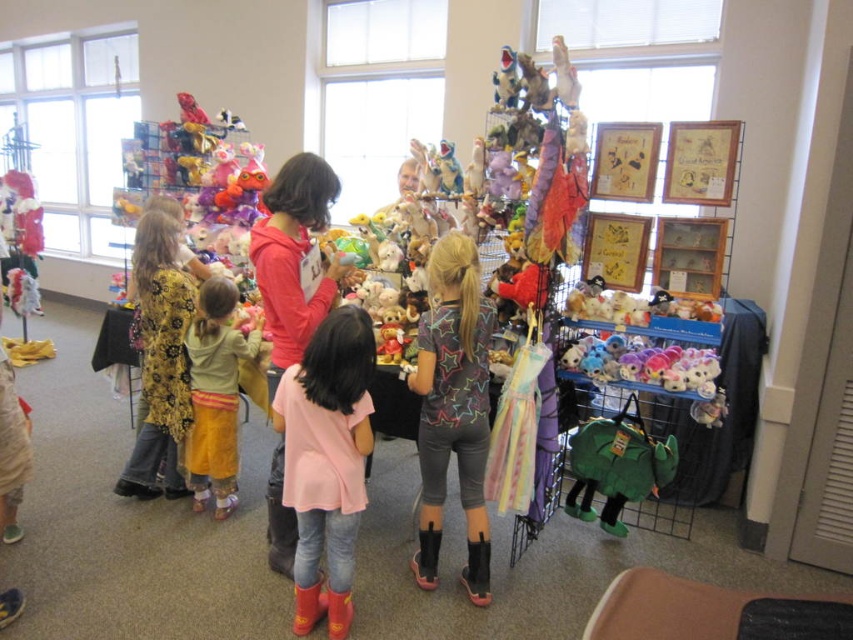
Looking at this image, you are a customer at the event and want to buy a clothing item. You see the pink fabric shirt at center and the yellow cotton dress at lower left. Which clothing item is taller?

The pink fabric shirt at center is taller than the yellow cotton dress at lower left.

You are a customer at the event and want to pick up both the pink fabric shirt at center and the yellow cotton dress at lower left. Which item should you look for first if you start from the bottom of the display rack?

The pink fabric shirt at center is located below the yellow cotton dress at lower left, so you should look for the pink fabric shirt at center first since it is lower down on the rack.

You are a customer at the event and want to buy both the pink fabric shirt at center and the yellow cotton dress at lower left. You have a bag that can hold items up to 1 meter in width. Can you fit both items in your bag without folding them?

The pink fabric shirt at center is wider than the yellow cotton dress at lower left. Since the bag can hold items up to 1 meter in width, you need to check if the combined width of both items exceeds the limit. However, the exact widths are not provided, so it is uncertain whether they will fit together without folding.